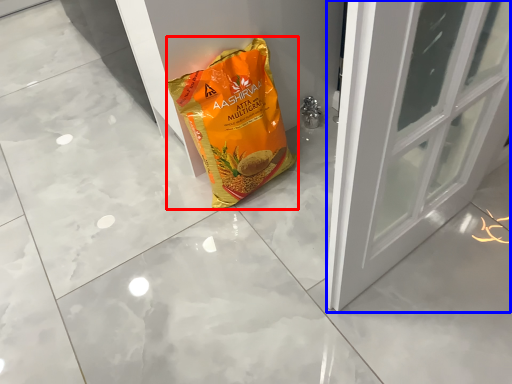
Question: Among these objects, which one is nearest to the camera, plastic bag (highlighted by a red box) or door (highlighted by a blue box)?

Choices:
 (A) plastic bag
 (B) door

Answer: (A)